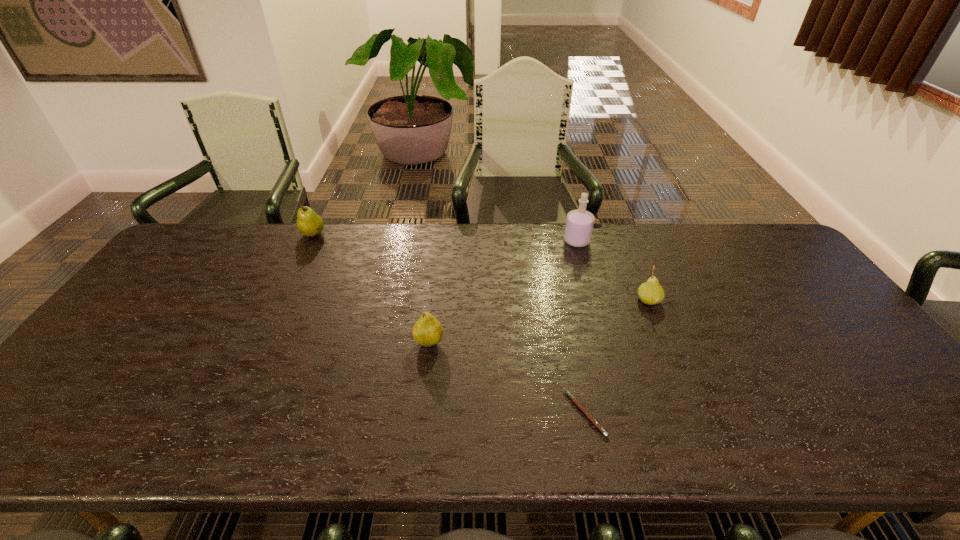
This screenshot has height=540, width=960. What are the coordinates of `vacant region between the tallest object and the second nearest object` in the screenshot? It's located at (503, 292).

The height and width of the screenshot is (540, 960). Identify the location of vacant region between the third nearest object and the third object from right to left. (616, 357).

This screenshot has width=960, height=540. What are the coordinates of `vacant space that's between the perfume and the pen` in the screenshot? It's located at (x=581, y=327).

At what (x,y) coordinates should I click in order to perform the action: click on vacant area between the rightmost object and the tallest object. Please return your answer as a coordinate pair (x, y). Looking at the image, I should click on point(612,271).

The image size is (960, 540). In order to click on free space between the nearest object and the second nearest object in this screenshot , I will do point(507,378).

Image resolution: width=960 pixels, height=540 pixels. Find the location of `vacant space that's between the third object from right to left and the second nearest object`. vacant space that's between the third object from right to left and the second nearest object is located at coordinates tap(507, 378).

The image size is (960, 540). What are the coordinates of `the closest object relative to the third object from right to left` in the screenshot? It's located at click(x=427, y=331).

The image size is (960, 540). What are the coordinates of `object identified as the second closest to the second object from right to left` in the screenshot? It's located at (427, 331).

Locate which pear ranks in proximity to the second pear from right to left. Please provide its 2D coordinates. Your answer should be formatted as a tuple, i.e. [(x, y)], where the tuple contains the x and y coordinates of a point satisfying the conditions above.

[(309, 223)]

Find the location of a particular element. Image resolution: width=960 pixels, height=540 pixels. pear that can be found as the second closest to the rightmost object is located at coordinates (309, 223).